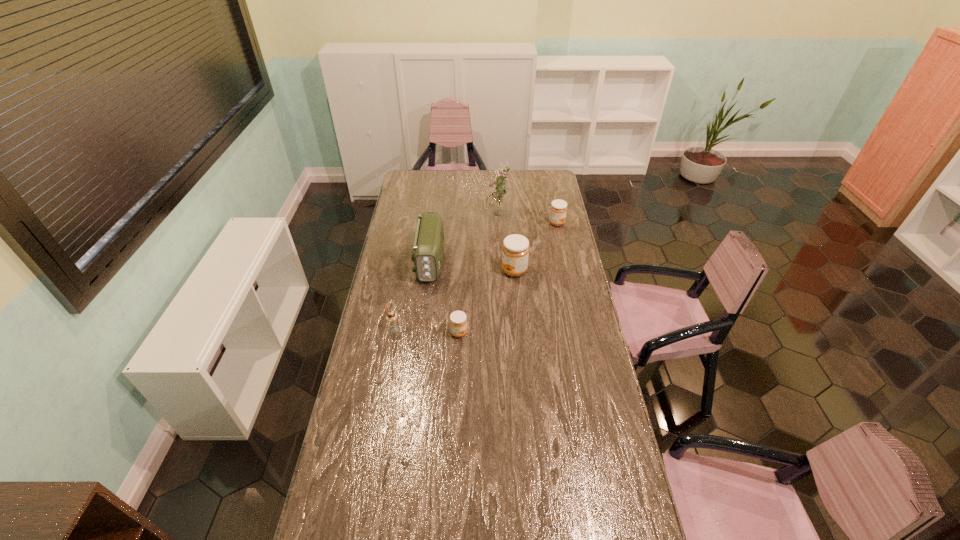
Where is `blank space located on the front label of the second nearest jam`? The height and width of the screenshot is (540, 960). blank space located on the front label of the second nearest jam is located at coordinates (484, 271).

Where is `vacant area situated on the front label of the second nearest jam`? The height and width of the screenshot is (540, 960). vacant area situated on the front label of the second nearest jam is located at coordinates (446, 271).

Image resolution: width=960 pixels, height=540 pixels. I want to click on vacant space located on the front label of the second nearest jam, so pyautogui.click(x=442, y=271).

At what (x,y) coordinates should I click in order to perform the action: click on free space located on the front-facing side of the tallest object. Please return your answer as a coordinate pair (x, y). Looking at the image, I should click on (412, 217).

Where is `vacant space located on the front-facing side of the tallest object`? The width and height of the screenshot is (960, 540). vacant space located on the front-facing side of the tallest object is located at coordinates (468, 217).

Image resolution: width=960 pixels, height=540 pixels. Find the location of `vacant space situated on the front-facing side of the tallest object`. vacant space situated on the front-facing side of the tallest object is located at coordinates (472, 217).

Where is `vacant space situated 0.350m on the front-facing side of the radio_receiver`? vacant space situated 0.350m on the front-facing side of the radio_receiver is located at coordinates (420, 346).

Image resolution: width=960 pixels, height=540 pixels. I want to click on free region located 0.050m on the front of the icecream, so click(x=391, y=345).

Where is `radio_receiver situated at the left edge`? This screenshot has width=960, height=540. radio_receiver situated at the left edge is located at coordinates (428, 246).

The image size is (960, 540). Find the location of `icecream that is at the left edge`. icecream that is at the left edge is located at coordinates (391, 317).